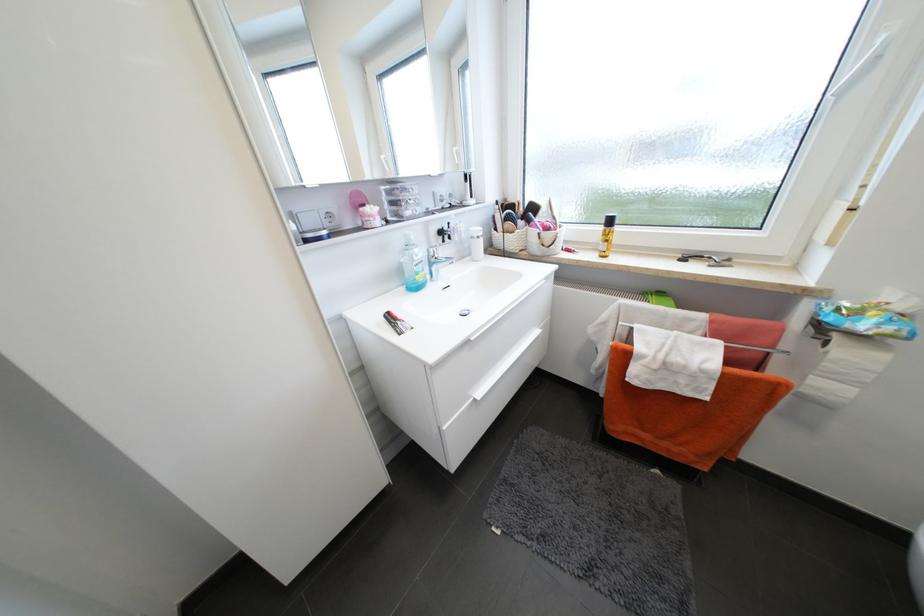
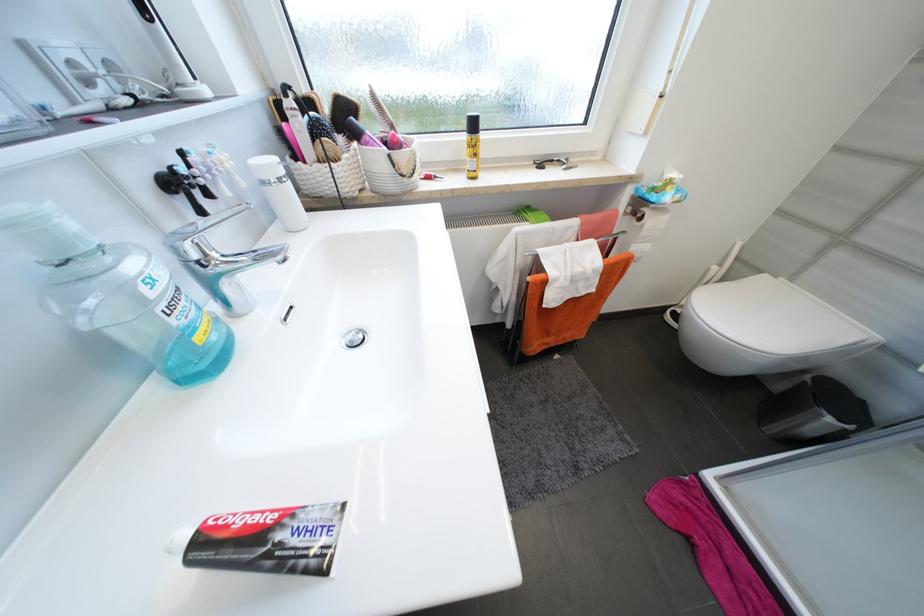
Where in the second image is the point corresponding to point 609,248 from the first image?

(477, 166)